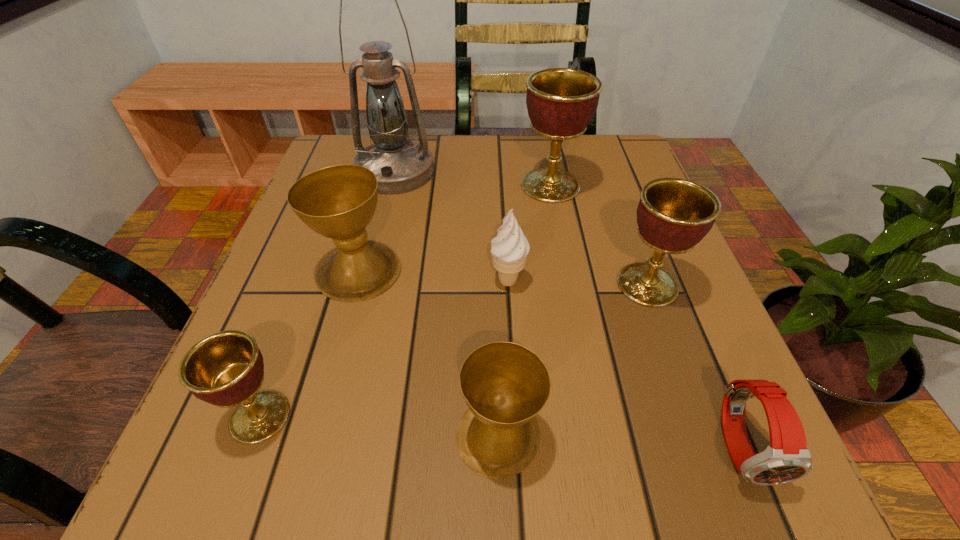
At what (x,y) coordinates should I click in order to perform the action: click on vacant area located 0.400m on the back of the smallest golden chalice. Please return your answer as a coordinate pair (x, y). This screenshot has height=540, width=960. Looking at the image, I should click on (335, 212).

Where is `oil lamp that is at the far edge`? oil lamp that is at the far edge is located at coordinates (400, 165).

Where is `chalice present at the far edge`? The height and width of the screenshot is (540, 960). chalice present at the far edge is located at coordinates (561, 102).

Identify the location of watch present at the near edge. (787, 458).

Where is `oil lamp that is positioned at the left edge`? oil lamp that is positioned at the left edge is located at coordinates (400, 165).

This screenshot has height=540, width=960. I want to click on watch that is at the right edge, so click(x=787, y=458).

Locate an element on the screen. object that is positioned at the far left corner is located at coordinates (400, 165).

Locate an element on the screen. Image resolution: width=960 pixels, height=540 pixels. object present at the near left corner is located at coordinates (226, 369).

I want to click on object that is at the far right corner, so click(561, 102).

Where is `object at the near right corner`? object at the near right corner is located at coordinates (787, 458).